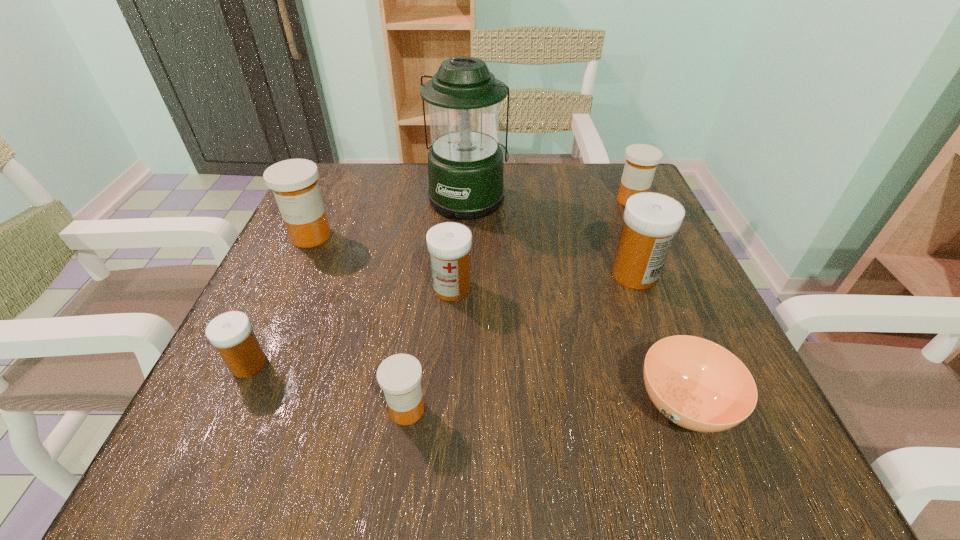
This screenshot has height=540, width=960. I want to click on free point between the second white medicine from right to left and the sixth nearest object, so click(381, 262).

I want to click on unoccupied area between the biggest white medicine and the nearest white medicine, so click(442, 319).

Find the location of a particular element. The image size is (960, 540). empty location between the tallest object and the smallest orange medicine is located at coordinates (438, 303).

At what (x,y) coordinates should I click in order to perform the action: click on free spot between the peach soup bowl and the second smallest white medicine. Please return your answer as a coordinate pair (x, y). Looking at the image, I should click on (568, 346).

Locate an element on the screen. free space that is in between the nearest medicine and the fifth farthest medicine is located at coordinates (328, 387).

The image size is (960, 540). What are the coordinates of `free space between the soup bowl and the green lantern` in the screenshot? It's located at (576, 301).

Locate an element on the screen. This screenshot has height=540, width=960. object that stands as the sixth closest to the smallest white medicine is located at coordinates (651, 220).

The image size is (960, 540). In order to click on the closest object to the second biggest white medicine in this screenshot , I will do `click(465, 163)`.

Locate an element on the screen. The image size is (960, 540). medicine that stands as the closest to the farthest orange medicine is located at coordinates pos(651,220).

Where is `medicine that stands as the second closest to the biggest white medicine`? This screenshot has width=960, height=540. medicine that stands as the second closest to the biggest white medicine is located at coordinates (449, 243).